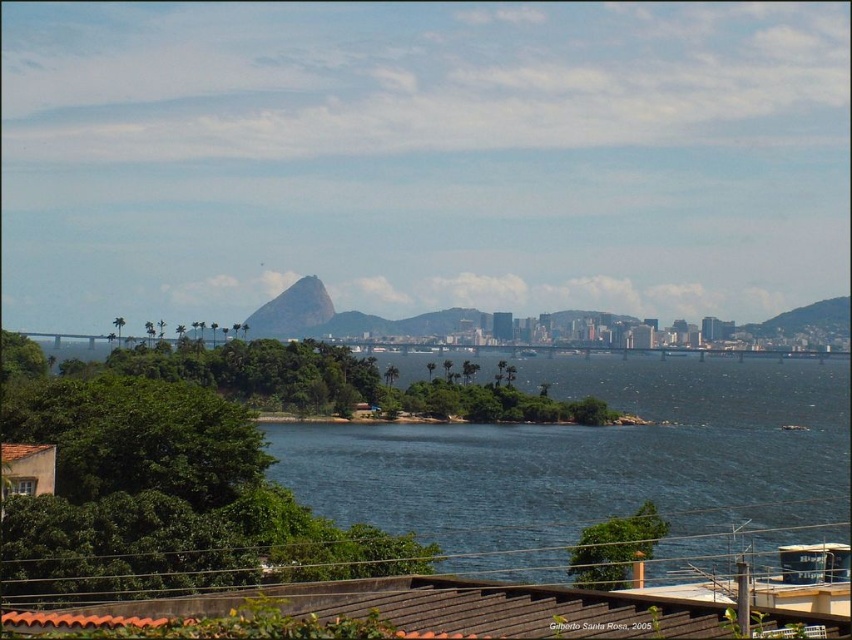
Does blue water at center have a greater height compared to green rough rock at center?

No, blue water at center is not taller than green rough rock at center.

Between blue water at center and green rough rock at center, which one is positioned higher?

green rough rock at center is above.

The image size is (852, 640). Describe the element at coordinates (599, 465) in the screenshot. I see `blue water at center` at that location.

Identify the location of blue water at center. This screenshot has height=640, width=852. pyautogui.click(x=599, y=465).